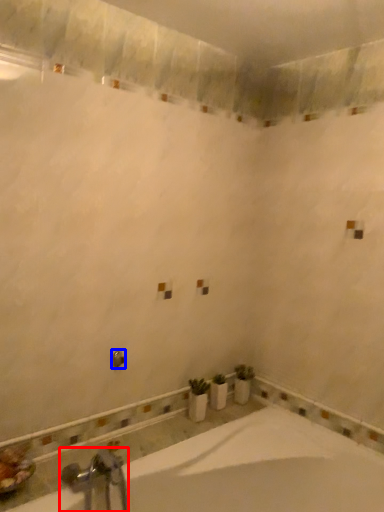
Question: Which object appears closest to the camera in this image, tap (highlighted by a red box) or shower (highlighted by a blue box)?

Choices:
 (A) tap
 (B) shower

Answer: (A)